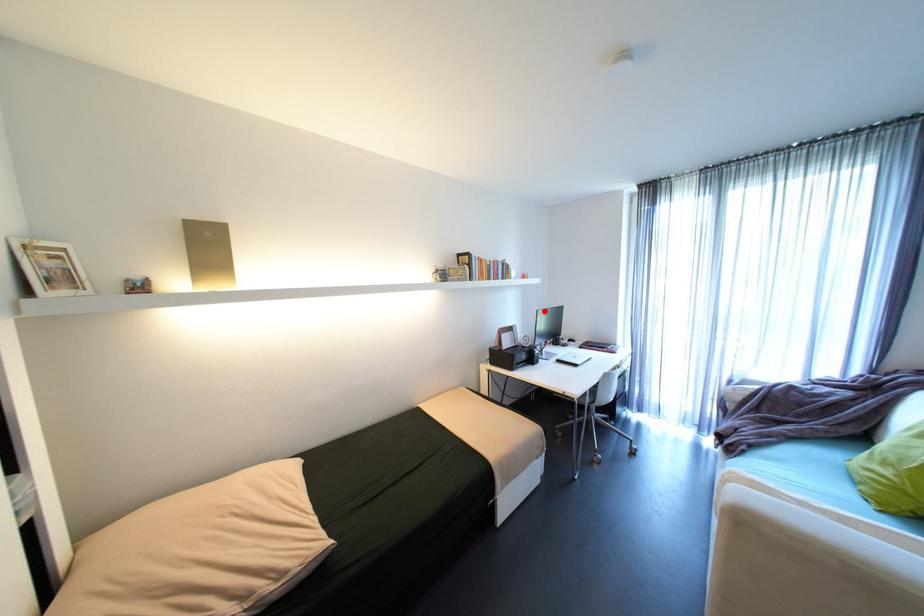
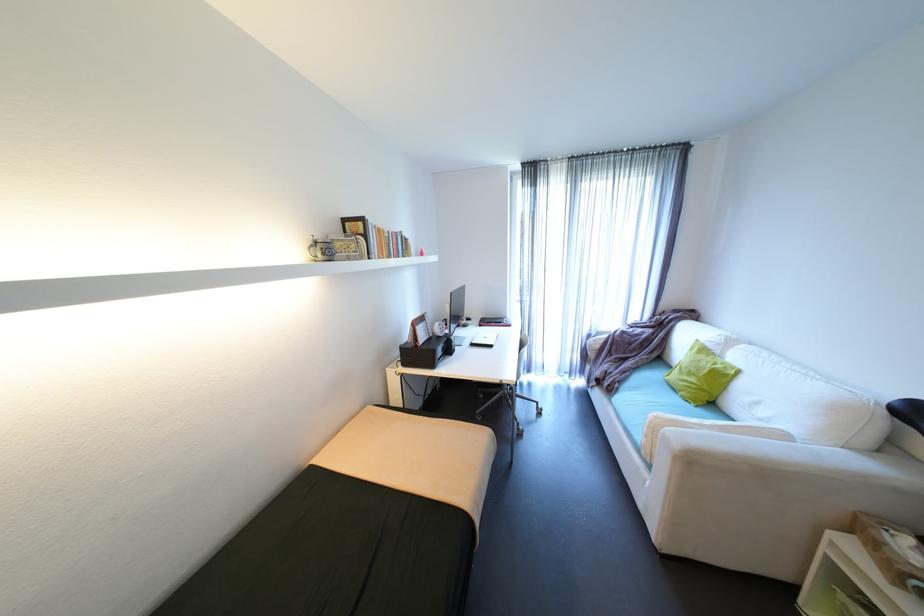
Question: I am providing you with two images of the same scene from different viewpoints. A red point is marked on the first image. At the location where the point appears in image 1, is it still visible in image 2?

Choices:
 (A) Yes
 (B) No

Answer: (A)